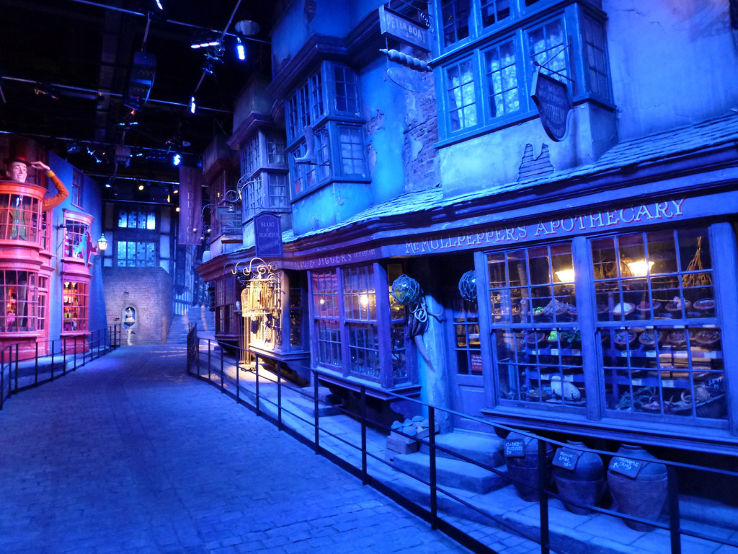
Where is `urns`? urns is located at coordinates (524, 473), (582, 483), (624, 491).